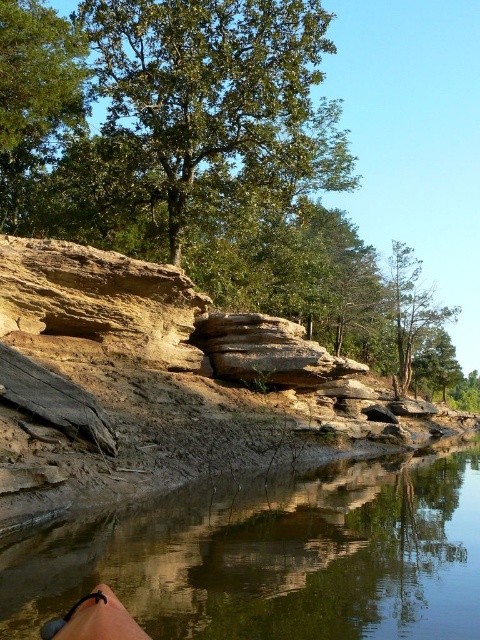
You are a hiker who needs to cross the brown dirt river at lower center. The green leafy tree at upper left has a rope hanging from its branches. Can you use the rope to reach the other side of the river?

The brown dirt river at lower center and the green leafy tree at upper left are 20.41 meters apart from each other. Since the distance between them is too large for a rope to span safely, you cannot use the rope to reach the other side of the river.

You are standing at the bottom left corner of the image. You want to walk towards the brown dirt river at lower center. Which direction should you move relative to the green leafy tree at upper left?

You should move to the right of the green leafy tree at upper left to reach the brown dirt river at lower center.

You are standing at the rocky shoreline and want to walk from point A to point B. Point A is located at coordinates point (x=411, y=556) and point B is at point (x=19, y=138). Based on the scene description, which direction should you face to move from point A towards point B?

To move from point A at coordinates point (x=411, y=556) towards point B at point (x=19, y=138), you should face diagonally towards the upper left direction since point A is in front of point B in the scene.